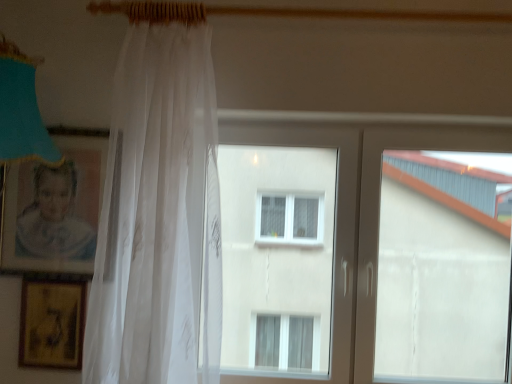
Question: Considering their positions, is matte cardboard picture frame at left, placed as the 1th picture frame when sorted from top to bottom, located in front of or behind gold textured picture frame at lower left, which is counted as the 1th picture frame, starting from the bottom?

Choices:
 (A) behind
 (B) front

Answer: (B)

Question: Is matte cardboard picture frame at left, placed as the 1th picture frame when sorted from top to bottom, situated inside gold textured picture frame at lower left, the second picture frame from the top, or outside?

Choices:
 (A) outside
 (B) inside

Answer: (A)

Question: Which object is positioned closest to the matte cardboard picture frame at left, the 2th picture frame in the bottom-to-top sequence?

Choices:
 (A) white plastic window at center
 (B) gold textured picture frame at lower left, the second picture frame from the top
 (C) translucent white curtain at left

Answer: (B)

Question: Estimate the real-world distances between objects in this image. Which object is farther from the white plastic window at center?

Choices:
 (A) matte cardboard picture frame at left, the 2th picture frame in the bottom-to-top sequence
 (B) gold textured picture frame at lower left, the second picture frame from the top
 (C) translucent white curtain at left

Answer: (B)